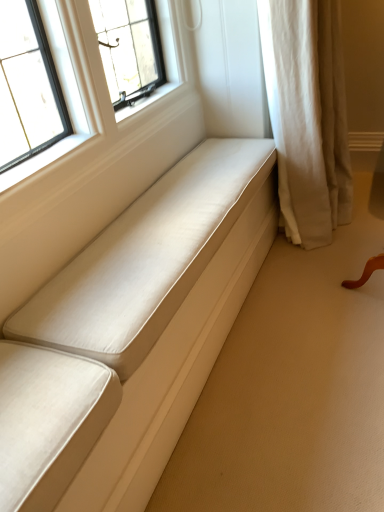
Question: From the image's perspective, does beige fabric curtain at right appear lower than matte white cushion at center?

Choices:
 (A) yes
 (B) no

Answer: (B)

Question: Is beige fabric curtain at right facing towards matte white cushion at center?

Choices:
 (A) no
 (B) yes

Answer: (A)

Question: Can we say beige fabric curtain at right lies outside matte white cushion at center?

Choices:
 (A) no
 (B) yes

Answer: (B)

Question: Is beige fabric curtain at right at the left side of matte white cushion at center?

Choices:
 (A) yes
 (B) no

Answer: (B)

Question: Is beige fabric curtain at right shorter than matte white cushion at center?

Choices:
 (A) no
 (B) yes

Answer: (A)

Question: Can you confirm if beige fabric curtain at right is smaller than matte white cushion at center?

Choices:
 (A) yes
 (B) no

Answer: (B)

Question: Is matte white cushion at center oriented towards beige fabric curtain at right?

Choices:
 (A) no
 (B) yes

Answer: (A)

Question: From the image's perspective, does matte white cushion at center appear lower than beige fabric curtain at right?

Choices:
 (A) no
 (B) yes

Answer: (B)

Question: Does matte white cushion at center have a lesser width compared to beige fabric curtain at right?

Choices:
 (A) no
 (B) yes

Answer: (B)

Question: Would you say matte white cushion at center is outside beige fabric curtain at right?

Choices:
 (A) no
 (B) yes

Answer: (B)

Question: Is the position of matte white cushion at center less distant than that of beige fabric curtain at right?

Choices:
 (A) yes
 (B) no

Answer: (A)

Question: From the image's perspective, does matte white cushion at center appear higher than beige fabric curtain at right?

Choices:
 (A) yes
 (B) no

Answer: (B)

Question: From a real-world perspective, relative to beige fabric curtain at right, is matte white cushion at center vertically above or below?

Choices:
 (A) below
 (B) above

Answer: (A)